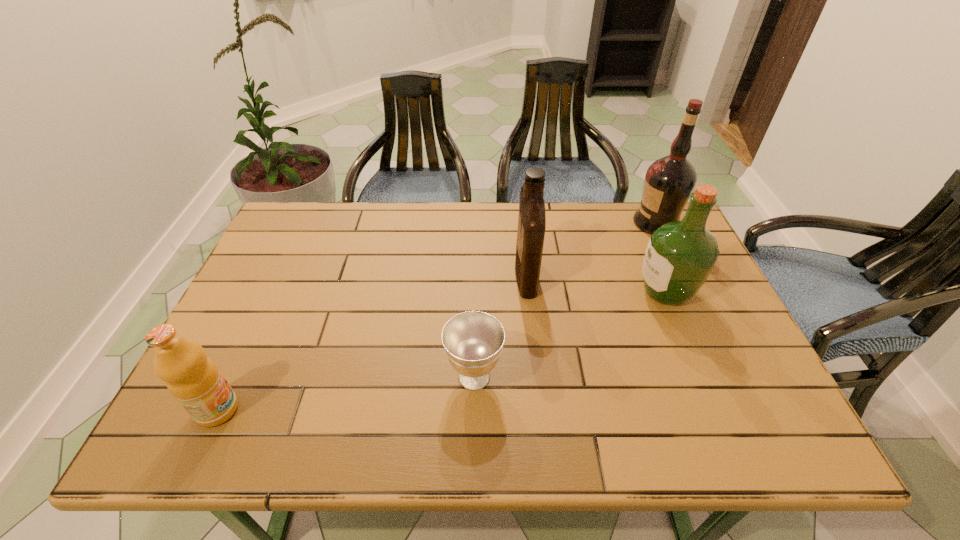
I want to click on vacant region at the far edge of the desktop, so click(360, 242).

Where is `free location at the near edge`? Image resolution: width=960 pixels, height=540 pixels. free location at the near edge is located at coordinates (610, 424).

Locate an element on the screen. free region at the right edge of the desktop is located at coordinates (723, 343).

You are a GUI agent. You are given a task and a screenshot of the screen. Output one action in this format:
    pyautogui.click(x=<x>, y=<y>)
    Task: Click on the free location at the far left corner of the desktop
    
    Given the screenshot: What is the action you would take?
    pyautogui.click(x=323, y=242)

In the image, there is a desktop. Where is `vacant region at the near right corner`? vacant region at the near right corner is located at coordinates (780, 435).

Locate an element on the screen. vacant area between the fourth tallest object and the third object from right to left is located at coordinates point(372,342).

I want to click on unoccupied area between the second shortest object and the third object from right to left, so click(x=372, y=342).

Image resolution: width=960 pixels, height=540 pixels. What are the coordinates of `object that is the second closest to the shortest object` in the screenshot? It's located at (680, 255).

You are a GUI agent. You are given a task and a screenshot of the screen. Output one action in this format:
    pyautogui.click(x=<x>, y=<y>)
    Task: Click on the object that is the fourth closest one to the farthest liquor
    The image size is (960, 540).
    Given the screenshot: What is the action you would take?
    pyautogui.click(x=195, y=381)

The image size is (960, 540). Identify the location of liquor that stands as the second closest to the shortest object. (680, 255).